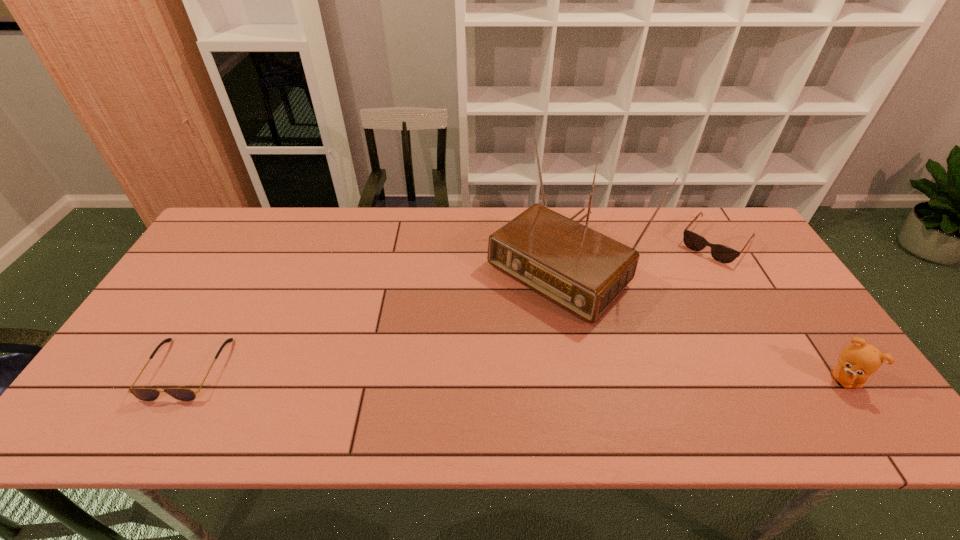
Find the location of a particular element. Image resolution: width=960 pixels, height=540 pixels. vacant space that is in between the farther sunglasses and the second tallest object is located at coordinates (780, 310).

Locate an element on the screen. The height and width of the screenshot is (540, 960). free space between the left sunglasses and the farther sunglasses is located at coordinates (451, 305).

This screenshot has height=540, width=960. I want to click on empty space between the left sunglasses and the third shortest object, so click(515, 373).

Locate an element on the screen. vacant area that lies between the third object from right to left and the third shortest object is located at coordinates (701, 319).

Locate an element on the screen. The width and height of the screenshot is (960, 540). object that is the second closest to the right sunglasses is located at coordinates (858, 361).

Choose which object is the nearest neighbor to the farther sunglasses. Please provide its 2D coordinates. Your answer should be formatted as a tuple, i.e. [(x, y)], where the tuple contains the x and y coordinates of a point satisfying the conditions above.

[(583, 271)]